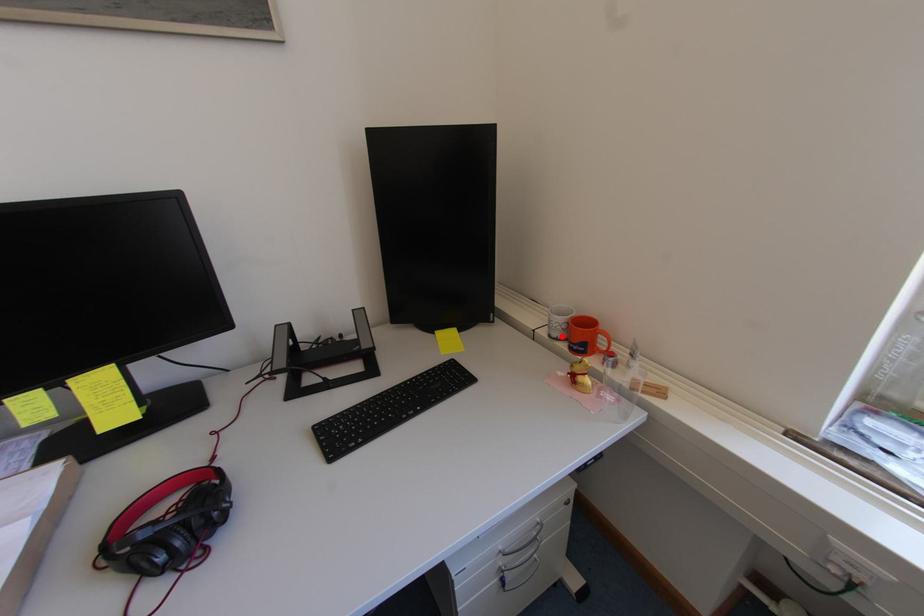
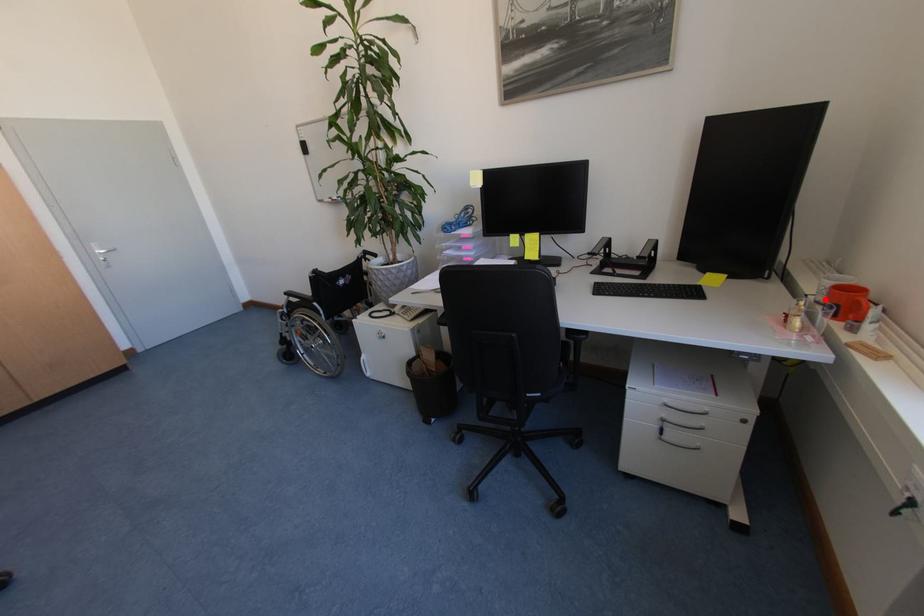
I am providing you with two images of the same scene from different viewpoints. A red point is marked on the first image and another point is marked on the second image. Does the point marked in image1 correspond to the same location as the one in image2?

Yes